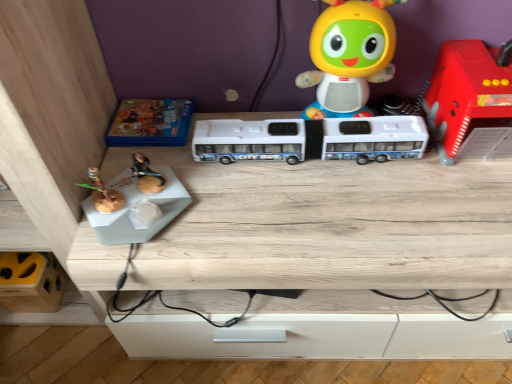
I want to click on white plastic bus at center, acting as the third toy starting from the right, so click(x=311, y=139).

What is the approximate height of yellow matte toy at lower left, which is the 1th toy from left to right?

The height of yellow matte toy at lower left, which is the 1th toy from left to right, is 5.02 inches.

Locate an element on the screen. Image resolution: width=512 pixels, height=384 pixels. rubberized red fire truck at right, the 5th toy positioned from the left is located at coordinates (471, 101).

Based on the photo, from the image's perspective, is matte plastic toy at upper center, marked as the fourth toy in a left-to-right arrangement, located above or below wooden table at center?

matte plastic toy at upper center, marked as the fourth toy in a left-to-right arrangement, is above wooden table at center.

Is matte plastic toy at upper center, marked as the fourth toy in a left-to-right arrangement, oriented away from wooden table at center?

matte plastic toy at upper center, marked as the fourth toy in a left-to-right arrangement, is not turned away from wooden table at center.

From a real-world perspective, between matte plastic toy at upper center, marked as the fourth toy in a left-to-right arrangement, and wooden table at center, who is vertically lower?

wooden table at center.

Find the location of a particular element. The height and width of the screenshot is (384, 512). toy that is the 4th one when counting upward from the wooden table at center (from the image's perspective) is located at coordinates (349, 57).

Can you tell me how much rubberized red fire truck at right, the 5th toy positioned from the left, and matte plastic toy at upper center, arranged as the 2th toy when viewed from the right, differ in facing direction?

The facing directions of rubberized red fire truck at right, the 5th toy positioned from the left, and matte plastic toy at upper center, arranged as the 2th toy when viewed from the right, are 0.63 degrees apart.

Is rubberized red fire truck at right, the 5th toy positioned from the left, at the right side of matte plastic toy at upper center, marked as the fourth toy in a left-to-right arrangement?

Indeed, rubberized red fire truck at right, the 5th toy positioned from the left, is positioned on the right side of matte plastic toy at upper center, marked as the fourth toy in a left-to-right arrangement.

Does rubberized red fire truck at right, the 5th toy positioned from the left, have a lesser height compared to matte plastic toy at upper center, arranged as the 2th toy when viewed from the right?

Yes.

Does rubberized red fire truck at right, which is the 1th toy in right-to-left order, have a greater width compared to matte plastic toy at upper center, marked as the fourth toy in a left-to-right arrangement?

Yes, rubberized red fire truck at right, which is the 1th toy in right-to-left order, is wider than matte plastic toy at upper center, marked as the fourth toy in a left-to-right arrangement.

Which object is further away from the camera taking this photo, matte plastic toy at upper center, marked as the fourth toy in a left-to-right arrangement, or white plastic bus at center, acting as the third toy starting from the right?

white plastic bus at center, acting as the third toy starting from the right, is behind.

Does matte plastic toy at upper center, marked as the fourth toy in a left-to-right arrangement, touch white plastic bus at center, acting as the third toy starting from the right?

matte plastic toy at upper center, marked as the fourth toy in a left-to-right arrangement, and white plastic bus at center, acting as the third toy starting from the right, are clearly separated.

Looking at this image, can you tell me how much matte plastic toy at upper center, arranged as the 2th toy when viewed from the right, and white plastic bus at center, the 3th toy positioned from the left, differ in facing direction?

1.27 degrees.

How far apart are matte plastic toy at upper center, marked as the fourth toy in a left-to-right arrangement, and white plastic bus at center, acting as the third toy starting from the right?

A distance of 4.37 inches exists between matte plastic toy at upper center, marked as the fourth toy in a left-to-right arrangement, and white plastic bus at center, acting as the third toy starting from the right.

Is white plastic bus at center, the 3th toy positioned from the left, at the back of yellow matte toy at lower left, which is the 1th toy from left to right?

No.

Is yellow matte toy at lower left, which is the 1th toy from left to right, far away from white plastic bus at center, acting as the third toy starting from the right?

They are positioned close to each other.

Is white plastic bus at center, the 3th toy positioned from the left, completely or partially inside yellow matte toy at lower left, which is the 1th toy from left to right?

Definitely not — white plastic bus at center, the 3th toy positioned from the left, is not inside yellow matte toy at lower left, which is the 1th toy from left to right.

The width and height of the screenshot is (512, 384). In order to click on toy below the white plastic bus at center, the 3th toy positioned from the left (from the image's perspective) in this screenshot , I will do `click(31, 282)`.

Is wooden table at center oriented away from rubberized red fire truck at right, the 5th toy positioned from the left?

That's not correct — wooden table at center is not looking away from rubberized red fire truck at right, the 5th toy positioned from the left.

From the image's perspective, is wooden table at center on rubberized red fire truck at right, the 5th toy positioned from the left?

No.

Considering the positions of points (212, 268) and (471, 147), is point (212, 268) closer to camera compared to point (471, 147)?

Yes, it is.

Which is correct: matte plastic toy at upper center, arranged as the 2th toy when viewed from the right, is inside yellow matte toy at lower left, the 5th toy in the right-to-left sequence, or outside of it?

matte plastic toy at upper center, arranged as the 2th toy when viewed from the right, lies outside yellow matte toy at lower left, the 5th toy in the right-to-left sequence.

Is matte plastic toy at upper center, arranged as the 2th toy when viewed from the right, at the left side of yellow matte toy at lower left, the 5th toy in the right-to-left sequence?

No, matte plastic toy at upper center, arranged as the 2th toy when viewed from the right, is not to the left of yellow matte toy at lower left, the 5th toy in the right-to-left sequence.

Measure the distance between matte plastic toy at upper center, marked as the fourth toy in a left-to-right arrangement, and yellow matte toy at lower left, which is the 1th toy from left to right.

matte plastic toy at upper center, marked as the fourth toy in a left-to-right arrangement, and yellow matte toy at lower left, which is the 1th toy from left to right, are 32.72 inches apart.

From the image's perspective, is matte plastic toy at upper center, arranged as the 2th toy when viewed from the right, above or below yellow matte toy at lower left, the 5th toy in the right-to-left sequence?

Based on their image positions, matte plastic toy at upper center, arranged as the 2th toy when viewed from the right, is located above yellow matte toy at lower left, the 5th toy in the right-to-left sequence.

Between yellow matte toy at lower left, the 5th toy in the right-to-left sequence, and wooden table at center, which one has more height?

Standing taller between the two is wooden table at center.

What's the angular difference between yellow matte toy at lower left, the 5th toy in the right-to-left sequence, and wooden table at center's facing directions?

There is a 2.92-degree angle between the facing directions of yellow matte toy at lower left, the 5th toy in the right-to-left sequence, and wooden table at center.

From the image's perspective, who appears lower, yellow matte toy at lower left, the 5th toy in the right-to-left sequence, or wooden table at center?

yellow matte toy at lower left, the 5th toy in the right-to-left sequence, appears lower in the image.

From the picture: Would you say yellow matte toy at lower left, which is the 1th toy from left to right, is inside or outside wooden table at center?

yellow matte toy at lower left, which is the 1th toy from left to right, is outside wooden table at center.

This screenshot has height=384, width=512. What are the coordinates of `table in front of the matte plastic toy at upper center, marked as the fourth toy in a left-to-right arrangement` in the screenshot? It's located at (330, 225).

This screenshot has height=384, width=512. Find the location of `toy that is the 1st object to the left of the rubberized red fire truck at right, which is the 1th toy in right-to-left order, starting at the anchor`. toy that is the 1st object to the left of the rubberized red fire truck at right, which is the 1th toy in right-to-left order, starting at the anchor is located at coordinates (349, 57).

From the picture: Based on their spatial positions, is rubberized red fire truck at right, the 5th toy positioned from the left, or matte plastic toy at upper center, arranged as the 2th toy when viewed from the right, closer to wooden table at center?

rubberized red fire truck at right, the 5th toy positioned from the left, lies closer to wooden table at center than the other object.

Considering their positions, is blue cardboard box at upper left, placed as the fourth toy when sorted from right to left, positioned closer to matte plastic toy at upper center, arranged as the 2th toy when viewed from the right, than white plastic bus at center, the 3th toy positioned from the left?

white plastic bus at center, the 3th toy positioned from the left, is positioned closer to the anchor matte plastic toy at upper center, arranged as the 2th toy when viewed from the right.

Considering their positions, is wooden table at center positioned further to rubberized red fire truck at right, which is the 1th toy in right-to-left order, than white plastic bus at center, the 3th toy positioned from the left?

wooden table at center is positioned further to the anchor rubberized red fire truck at right, which is the 1th toy in right-to-left order.

From the image, which object appears to be farther from white plastic bus at center, the 3th toy positioned from the left, yellow matte toy at lower left, which is the 1th toy from left to right, or matte plastic toy at upper center, marked as the fourth toy in a left-to-right arrangement?

Based on the image, yellow matte toy at lower left, which is the 1th toy from left to right, appears to be further to white plastic bus at center, the 3th toy positioned from the left.

Considering their positions, is rubberized red fire truck at right, which is the 1th toy in right-to-left order, positioned closer to yellow matte toy at lower left, the 5th toy in the right-to-left sequence, than matte plastic toy at upper center, marked as the fourth toy in a left-to-right arrangement?

The object closer to yellow matte toy at lower left, the 5th toy in the right-to-left sequence, is matte plastic toy at upper center, marked as the fourth toy in a left-to-right arrangement.

When comparing their distances from white plastic bus at center, acting as the third toy starting from the right, does blue cardboard box at upper left, the second toy in the left-to-right sequence, or wooden table at center seem closer?

The object closer to white plastic bus at center, acting as the third toy starting from the right, is wooden table at center.

From the image, which object appears to be farther from white plastic bus at center, the 3th toy positioned from the left, rubberized red fire truck at right, the 5th toy positioned from the left, or wooden table at center?

rubberized red fire truck at right, the 5th toy positioned from the left.

Looking at the image, which one is located closer to blue cardboard box at upper left, the second toy in the left-to-right sequence, wooden table at center or white plastic bus at center, the 3th toy positioned from the left?

white plastic bus at center, the 3th toy positioned from the left.

Identify the location of toy situated between yellow matte toy at lower left, which is the 1th toy from left to right, and white plastic bus at center, the 3th toy positioned from the left, from left to right. This screenshot has height=384, width=512. (150, 123).

Find the location of a particular element. toy located between blue cardboard box at upper left, the second toy in the left-to-right sequence, and matte plastic toy at upper center, marked as the fourth toy in a left-to-right arrangement, in the left-right direction is located at coordinates (311, 139).

Find the location of a particular element. The width and height of the screenshot is (512, 384). table between blue cardboard box at upper left, placed as the fourth toy when sorted from right to left, and rubberized red fire truck at right, the 5th toy positioned from the left, in the horizontal direction is located at coordinates (330, 225).

This screenshot has width=512, height=384. Find the location of `table between yellow matte toy at lower left, which is the 1th toy from left to right, and rubberized red fire truck at right, which is the 1th toy in right-to-left order, from left to right`. table between yellow matte toy at lower left, which is the 1th toy from left to right, and rubberized red fire truck at right, which is the 1th toy in right-to-left order, from left to right is located at coordinates (330, 225).